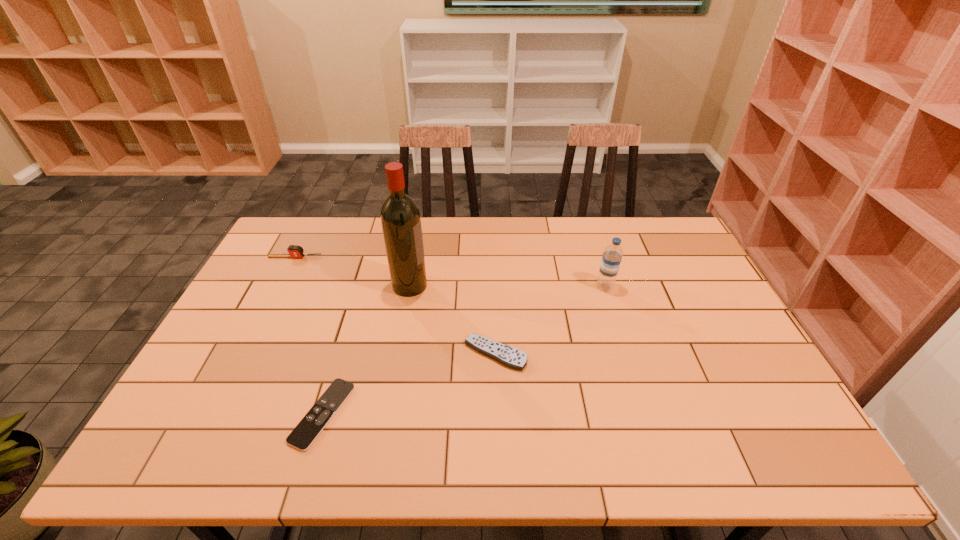
Image resolution: width=960 pixels, height=540 pixels. I want to click on vacant space located on the label of the wine bottle, so click(x=459, y=285).

I want to click on free space located on the label of the rightmost object, so click(481, 287).

I want to click on free space located 0.130m on the label of the rightmost object, so click(x=555, y=287).

The height and width of the screenshot is (540, 960). I want to click on free space located on the label of the rightmost object, so 494,287.

Identify the location of vacant space located on the right of the farthest object. The image size is (960, 540). (372, 257).

This screenshot has height=540, width=960. I want to click on free space located on the left of the fourth tallest object, so click(x=383, y=354).

The height and width of the screenshot is (540, 960). Find the location of `vacant area situated 0.350m on the right of the left remote control`. vacant area situated 0.350m on the right of the left remote control is located at coordinates (495, 414).

This screenshot has width=960, height=540. Find the location of `object positioned at the far edge`. object positioned at the far edge is located at coordinates (295, 251).

Image resolution: width=960 pixels, height=540 pixels. What are the coordinates of `object at the near edge` in the screenshot? It's located at (304, 434).

The width and height of the screenshot is (960, 540). What are the coordinates of `object present at the left edge` in the screenshot? It's located at (295, 251).